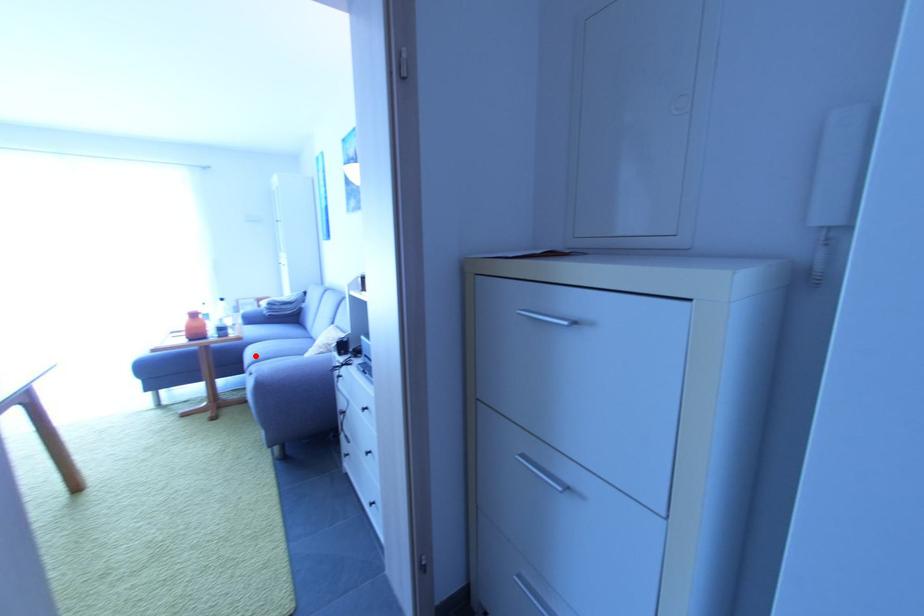
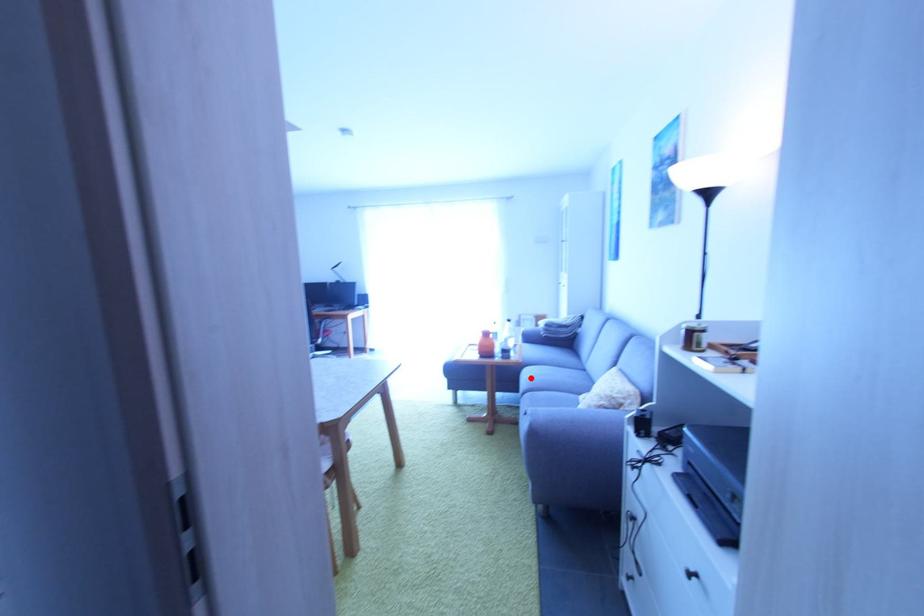
I am providing you with two images of the same scene from different viewpoints. A red point is marked on the first image and another point is marked on the second image. Does the point marked in image1 correspond to the same location as the one in image2?

Yes